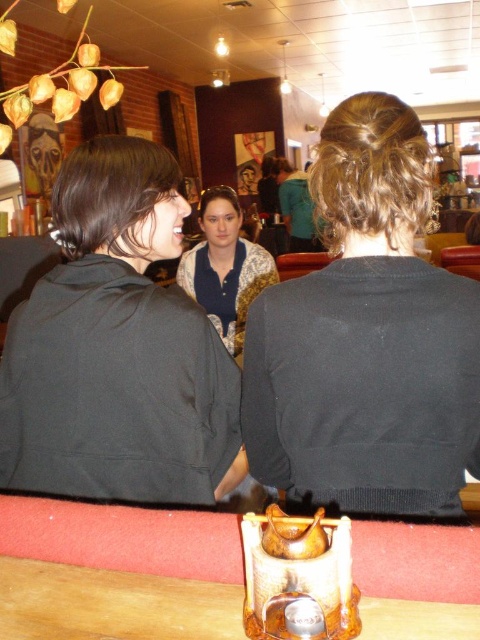
You are a barista preparing to place two drinks on the table. The matte black hoodie at center and the blue textured blouse at center are seated at the table. Which of the two clothing items is smaller in size?

The matte black hoodie at center is smaller in size compared to the blue textured blouse at center.

You are at the table in the image and want to place a small vase between the two points labeled point (368,355) and point (108,572). Which point should the vase be closer to if you want it to appear closer to you?

The vase should be placed closer to point (368,355) because it is further to the viewer than point (108,572), making it appear closer.

You are a photographer trying to capture a candid shot of the person at point (335, 113) and the person at point (256, 250). Since you want both subjects to be in focus, which person should you focus on first to ensure depth of field?

You should focus on the person at point (335, 113) first because they are closer to the camera, and focusing on the closer subject ensures the depth of field will extend to the farther subject at point (256, 250).